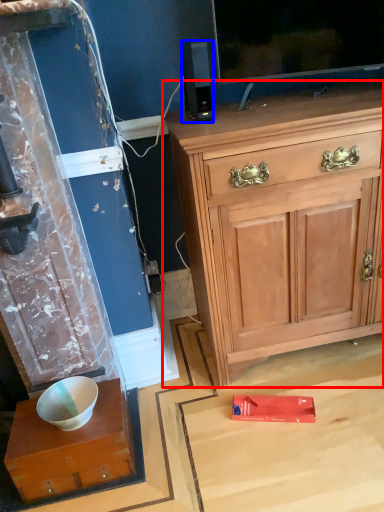
Question: Which of the following is the farthest to the observer, cabinetry (highlighted by a red box) or loudspeaker (highlighted by a blue box)?

Choices:
 (A) cabinetry
 (B) loudspeaker

Answer: (B)